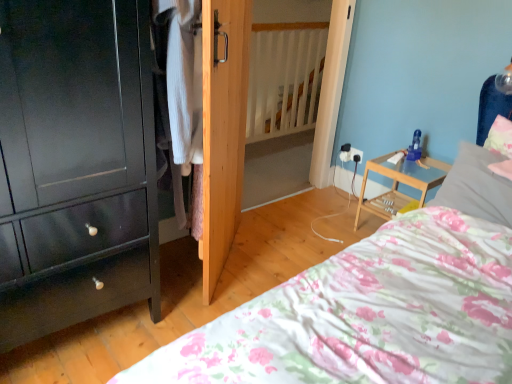
Question: From a real-world perspective, is fluffy pink pillow at upper right, the 2th pillow when ordered from left to right, physically located above or below blue plastic toy at upper right?

Choices:
 (A) below
 (B) above

Answer: (B)

Question: In terms of size, does fluffy pink pillow at upper right, the first pillow in the right-to-left sequence, appear bigger or smaller than blue plastic toy at upper right?

Choices:
 (A) big
 (B) small

Answer: (A)

Question: Based on their relative distances, which object is nearer to the matte black cabinet at left?

Choices:
 (A) knitted wool sweater at center
 (B) white soft pillow at upper right, marked as the 2th pillow in a right-to-left arrangement
 (C) wooden nightstand at right
 (D) fluffy pink pillow at upper right, the 2th pillow when ordered from left to right
 (E) natural wood door at center

Answer: (A)

Question: Based on their relative distances, which object is farther from the blue plastic toy at upper right?

Choices:
 (A) wooden nightstand at right
 (B) natural wood door at center
 (C) knitted wool sweater at center
 (D) matte black cabinet at left
 (E) floral cotton bed at lower right

Answer: (D)